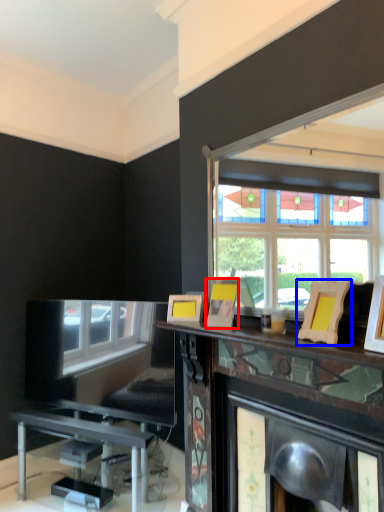
Question: Which object is further to the camera taking this photo, picture frame (highlighted by a red box) or picture frame (highlighted by a blue box)?

Choices:
 (A) picture frame
 (B) picture frame

Answer: (A)